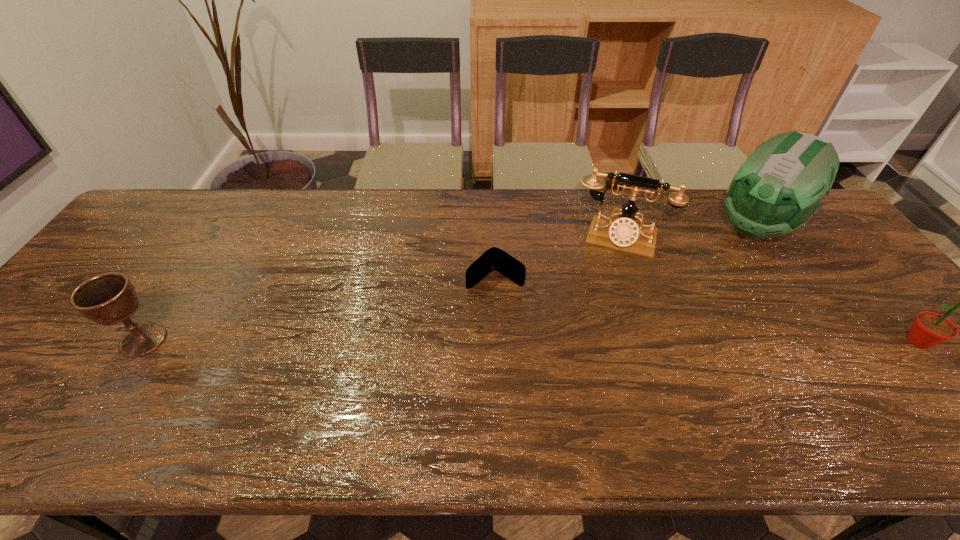
This screenshot has width=960, height=540. What are the coordinates of `free space between the second object from right to left and the wallet` in the screenshot? It's located at (626, 254).

Where is `vacant area that lies between the second object from right to left and the sunflower`? vacant area that lies between the second object from right to left and the sunflower is located at coordinates (837, 284).

Where is `vacant space in between the football helmet and the rightmost object`? This screenshot has height=540, width=960. vacant space in between the football helmet and the rightmost object is located at coordinates click(x=837, y=284).

Find the location of `unoccupied area between the football helmet and the sunflower`. unoccupied area between the football helmet and the sunflower is located at coordinates (837, 284).

Identify the location of unoccupied position between the fourth tallest object and the football helmet. The width and height of the screenshot is (960, 540). (450, 284).

Locate an element on the screen. free space between the football helmet and the fourth tallest object is located at coordinates (450, 284).

Locate an element on the screen. This screenshot has width=960, height=540. free spot between the third object from right to left and the football helmet is located at coordinates (687, 233).

Identify which object is the second nearest to the football helmet. Please provide its 2D coordinates. Your answer should be formatted as a tuple, i.e. [(x, y)], where the tuple contains the x and y coordinates of a point satisfying the conditions above.

[(929, 328)]

Select which object appears as the fourth closest to the wallet. Please provide its 2D coordinates. Your answer should be formatted as a tuple, i.e. [(x, y)], where the tuple contains the x and y coordinates of a point satisfying the conditions above.

[(929, 328)]

Locate an element on the screen. vacant space that satisfies the following two spatial constraints: 1. on the back side of the second object from right to left; 2. on the right side of the second shortest object is located at coordinates (217, 227).